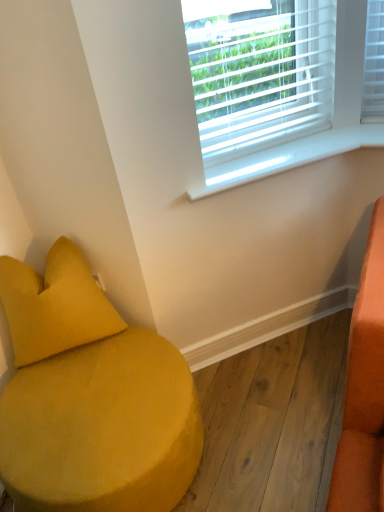
At what (x,y) coordinates should I click in order to perform the action: click on free space above velvet yellow ottoman at lower left (from a real-world perspective). Please return your answer as a coordinate pair (x, y). The image size is (384, 512). Looking at the image, I should click on (87, 398).